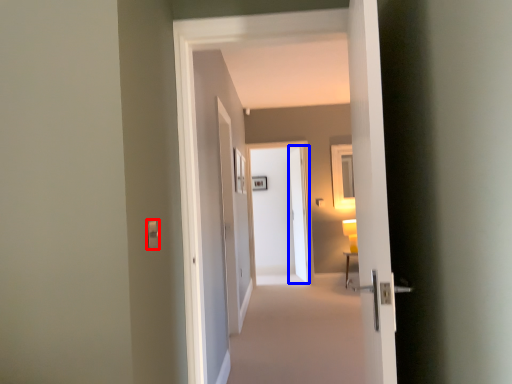
Question: Which object appears closest to the camera in this image, light switch (highlighted by a red box) or screen door (highlighted by a blue box)?

Choices:
 (A) light switch
 (B) screen door

Answer: (A)